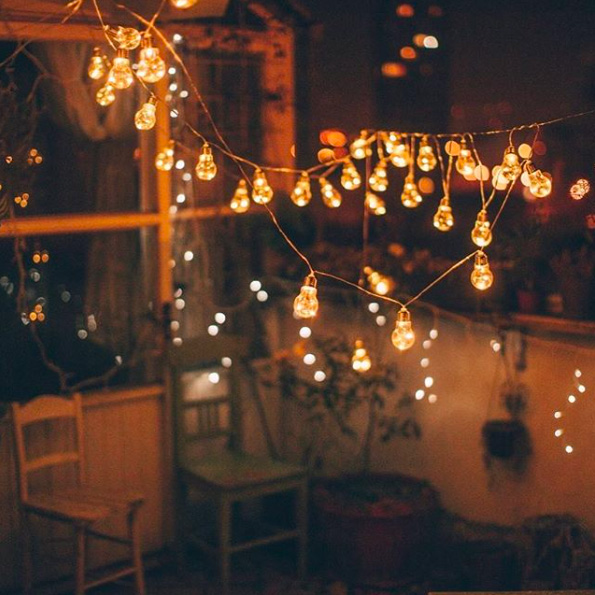
The image size is (595, 595). Identify the location of hanging pot. [502, 443].